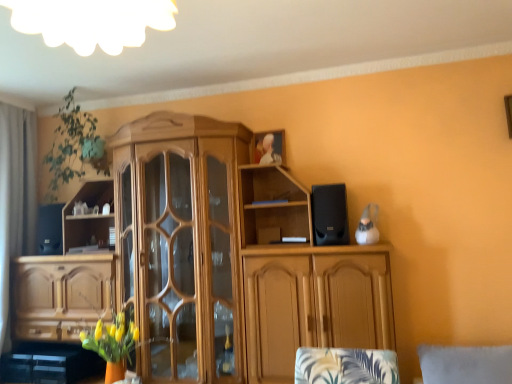
Question: From their relative heights in the image, would you say green leafy plant at upper left is taller or shorter than wooden cabinet at center?

Choices:
 (A) tall
 (B) short

Answer: (B)

Question: In terms of width, does green leafy plant at upper left look wider or thinner when compared to wooden cabinet at center?

Choices:
 (A) thin
 (B) wide

Answer: (A)

Question: Which object is the farthest from the wooden cabinet at center?

Choices:
 (A) black matte speaker at left, which is counted as the first speaker, starting from the left
 (B) green leafy plant at upper left
 (C) black matte speaker at upper right, the first speaker when ordered from front to back
 (D) gray fabric curtain at left

Answer: (D)

Question: Which object is the farthest from the green leafy plant at upper left?

Choices:
 (A) gray fabric curtain at left
 (B) wooden cabinet at center
 (C) black matte speaker at upper right, the second speaker when ordered from left to right
 (D) black matte speaker at left, which is counted as the first speaker, starting from the left

Answer: (C)